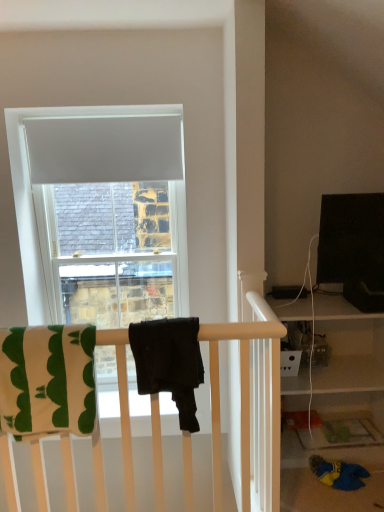
You are a GUI agent. You are given a task and a screenshot of the screen. Output one action in this format:
    pyautogui.click(x=<x>, y=<y>)
    Task: Click on the white matte curtain at upper center
    
    Given the screenshot: What is the action you would take?
    pyautogui.click(x=104, y=149)

The width and height of the screenshot is (384, 512). Describe the element at coordinates (169, 362) in the screenshot. I see `black matte towel at center, the 2th beach towel when ordered from left to right` at that location.

This screenshot has height=512, width=384. What are the coordinates of `white matte curtain at upper center` in the screenshot? It's located at (104, 149).

Is the position of white matte curtain at upper center less distant than that of green cotton beach towel at left, the second beach towel when ordered from right to left?

That is False.

Is white matte curtain at upper center aimed at green cotton beach towel at left, the second beach towel when ordered from right to left?

No, white matte curtain at upper center does not turn towards green cotton beach towel at left, the second beach towel when ordered from right to left.

Is the surface of white matte curtain at upper center in direct contact with green cotton beach towel at left, placed as the first beach towel when sorted from left to right?

white matte curtain at upper center is not next to green cotton beach towel at left, placed as the first beach towel when sorted from left to right, and they're not touching.

This screenshot has height=512, width=384. I want to click on beach towel on the left side of white matte curtain at upper center, so click(x=47, y=379).

How far apart are green cotton beach towel at left, the second beach towel when ordered from right to left, and black matte towel at center, the 1th beach towel in the right-to-left sequence?

They are 31.97 centimeters apart.

Which object is thinner, green cotton beach towel at left, placed as the first beach towel when sorted from left to right, or black matte towel at center, the 1th beach towel in the right-to-left sequence?

With smaller width is green cotton beach towel at left, placed as the first beach towel when sorted from left to right.

In the scene shown: Is green cotton beach towel at left, placed as the first beach towel when sorted from left to right, turned away from black matte towel at center, the 1th beach towel in the right-to-left sequence?

green cotton beach towel at left, placed as the first beach towel when sorted from left to right, is not turned away from black matte towel at center, the 1th beach towel in the right-to-left sequence.

Is green cotton beach towel at left, the second beach towel when ordered from right to left, smaller than black matte towel at center, the 2th beach towel when ordered from left to right?

Incorrect, green cotton beach towel at left, the second beach towel when ordered from right to left, is not smaller in size than black matte towel at center, the 2th beach towel when ordered from left to right.

Can you confirm if black matte towel at center, the 2th beach towel when ordered from left to right, is smaller than white matte curtain at upper center?

Incorrect, black matte towel at center, the 2th beach towel when ordered from left to right, is not smaller in size than white matte curtain at upper center.

In terms of height, does black matte towel at center, the 2th beach towel when ordered from left to right, look taller or shorter compared to white matte curtain at upper center?

Clearly, black matte towel at center, the 2th beach towel when ordered from left to right, is taller compared to white matte curtain at upper center.

Measure the distance between black matte towel at center, the 2th beach towel when ordered from left to right, and white matte curtain at upper center.

black matte towel at center, the 2th beach towel when ordered from left to right, and white matte curtain at upper center are 4.29 feet apart from each other.

I want to click on curtain behind the black matte towel at center, the 1th beach towel in the right-to-left sequence, so click(104, 149).

Can you confirm if green cotton beach towel at left, placed as the first beach towel when sorted from left to right, is smaller than white matte curtain at upper center?

Actually, green cotton beach towel at left, placed as the first beach towel when sorted from left to right, might be larger than white matte curtain at upper center.

Is green cotton beach towel at left, placed as the first beach towel when sorted from left to right, facing away from white matte curtain at upper center?

No, green cotton beach towel at left, placed as the first beach towel when sorted from left to right,'s orientation is not away from white matte curtain at upper center.

Looking at their sizes, would you say green cotton beach towel at left, placed as the first beach towel when sorted from left to right, is wider or thinner than white matte curtain at upper center?

green cotton beach towel at left, placed as the first beach towel when sorted from left to right, is wider than white matte curtain at upper center.

From a real-world perspective, is black matte towel at center, the 1th beach towel in the right-to-left sequence, physically located above or below green cotton beach towel at left, placed as the first beach towel when sorted from left to right?

black matte towel at center, the 1th beach towel in the right-to-left sequence, is situated higher than green cotton beach towel at left, placed as the first beach towel when sorted from left to right, in the real world.

Can we say black matte towel at center, the 1th beach towel in the right-to-left sequence, lies outside green cotton beach towel at left, placed as the first beach towel when sorted from left to right?

Yes, black matte towel at center, the 1th beach towel in the right-to-left sequence, is outside of green cotton beach towel at left, placed as the first beach towel when sorted from left to right.

How many degrees apart are the facing directions of black matte towel at center, the 1th beach towel in the right-to-left sequence, and green cotton beach towel at left, placed as the first beach towel when sorted from left to right?

0.000769 degrees separate the facing orientations of black matte towel at center, the 1th beach towel in the right-to-left sequence, and green cotton beach towel at left, placed as the first beach towel when sorted from left to right.

Between white matte curtain at upper center and black matte towel at center, the 2th beach towel when ordered from left to right, which one has larger size?

Bigger between the two is black matte towel at center, the 2th beach towel when ordered from left to right.

From a real-world perspective, who is located higher, white matte curtain at upper center or black matte towel at center, the 1th beach towel in the right-to-left sequence?

In real-world perspective, white matte curtain at upper center is above.

From the image's perspective, is white matte curtain at upper center on black matte towel at center, the 1th beach towel in the right-to-left sequence?

Indeed, from the image's perspective, white matte curtain at upper center is shown above black matte towel at center, the 1th beach towel in the right-to-left sequence.

From the picture: Is white matte curtain at upper center taller than black matte towel at center, the 2th beach towel when ordered from left to right?

In fact, white matte curtain at upper center may be shorter than black matte towel at center, the 2th beach towel when ordered from left to right.

Where is `the 2nd beach towel directly beneath the white matte curtain at upper center (from a real-world perspective)`? the 2nd beach towel directly beneath the white matte curtain at upper center (from a real-world perspective) is located at coordinates (47, 379).

Locate an element on the screen. beach towel on the right of green cotton beach towel at left, placed as the first beach towel when sorted from left to right is located at coordinates (169, 362).

Which object lies further to the anchor point green cotton beach towel at left, placed as the first beach towel when sorted from left to right, black matte towel at center, the 2th beach towel when ordered from left to right, or white matte curtain at upper center?

white matte curtain at upper center is further to green cotton beach towel at left, placed as the first beach towel when sorted from left to right.

Looking at the image, which one is located closer to white matte curtain at upper center, green cotton beach towel at left, the second beach towel when ordered from right to left, or black matte towel at center, the 2th beach towel when ordered from left to right?

Among the two, green cotton beach towel at left, the second beach towel when ordered from right to left, is located nearer to white matte curtain at upper center.

Looking at the image, which one is located further to black matte towel at center, the 2th beach towel when ordered from left to right, green cotton beach towel at left, placed as the first beach towel when sorted from left to right, or white matte curtain at upper center?

white matte curtain at upper center is further to black matte towel at center, the 2th beach towel when ordered from left to right.

From the image, which object appears to be farther from white matte curtain at upper center, black matte towel at center, the 2th beach towel when ordered from left to right, or green cotton beach towel at left, placed as the first beach towel when sorted from left to right?

black matte towel at center, the 2th beach towel when ordered from left to right.

Considering their positions, is white matte curtain at upper center positioned closer to black matte towel at center, the 2th beach towel when ordered from left to right, than green cotton beach towel at left, placed as the first beach towel when sorted from left to right?

green cotton beach towel at left, placed as the first beach towel when sorted from left to right, is closer to black matte towel at center, the 2th beach towel when ordered from left to right.

Based on their spatial positions, is white matte curtain at upper center or black matte towel at center, the 1th beach towel in the right-to-left sequence, closer to green cotton beach towel at left, the second beach towel when ordered from right to left?

black matte towel at center, the 1th beach towel in the right-to-left sequence, lies closer to green cotton beach towel at left, the second beach towel when ordered from right to left, than the other object.

Locate an element on the screen. The height and width of the screenshot is (512, 384). beach towel between white matte curtain at upper center and green cotton beach towel at left, the second beach towel when ordered from right to left, from top to bottom is located at coordinates (169, 362).